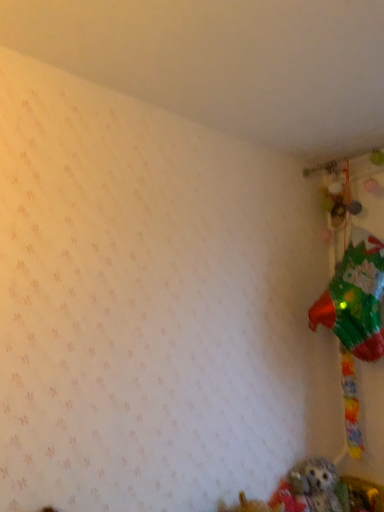
This screenshot has height=512, width=384. Identify the location of fuzzy fabric owl at lower right. (318, 486).

This screenshot has width=384, height=512. Describe the element at coordinates (318, 486) in the screenshot. I see `fuzzy fabric owl at lower right` at that location.

The image size is (384, 512). Find the location of `fuzzy fabric owl at lower right`. fuzzy fabric owl at lower right is located at coordinates (318, 486).